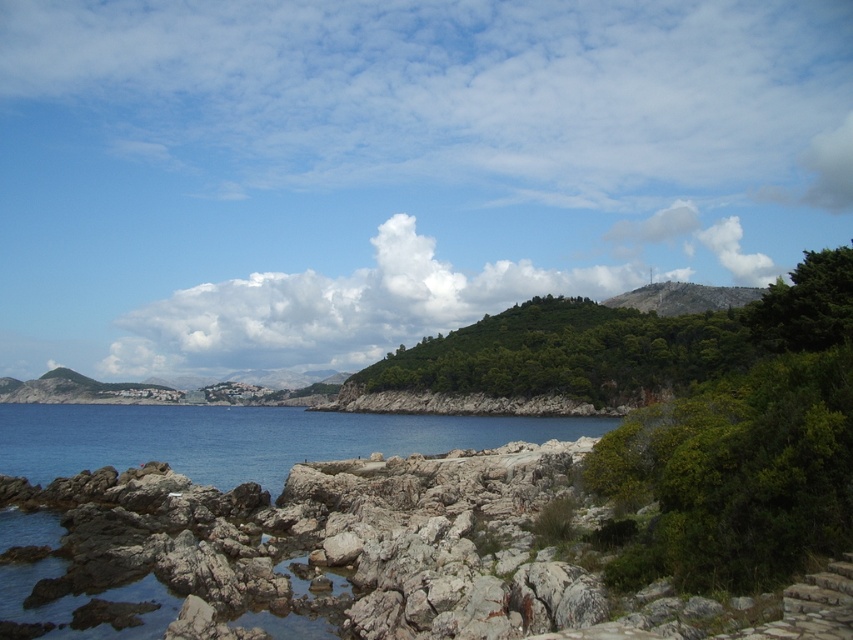
Question: Is white fluffy cloud at upper center further to camera compared to blue water at lower left?

Choices:
 (A) yes
 (B) no

Answer: (A)

Question: Which point is farther to the camera?

Choices:
 (A) green leafy hill at center
 (B) white fluffy cloud at upper center
 (C) blue water at lower left

Answer: (B)

Question: Does white fluffy cloud at upper center have a larger size compared to blue water at lower left?

Choices:
 (A) no
 (B) yes

Answer: (B)

Question: Among these objects, which one is farthest from the camera?

Choices:
 (A) blue water at lower left
 (B) white fluffy cloud at upper center

Answer: (B)

Question: Which object is positioned closest to the green leafy hill at center?

Choices:
 (A) white fluffy cloud at upper center
 (B) blue water at lower left

Answer: (B)

Question: In this image, where is green leafy hill at center located relative to blue water at lower left?

Choices:
 (A) right
 (B) left

Answer: (A)